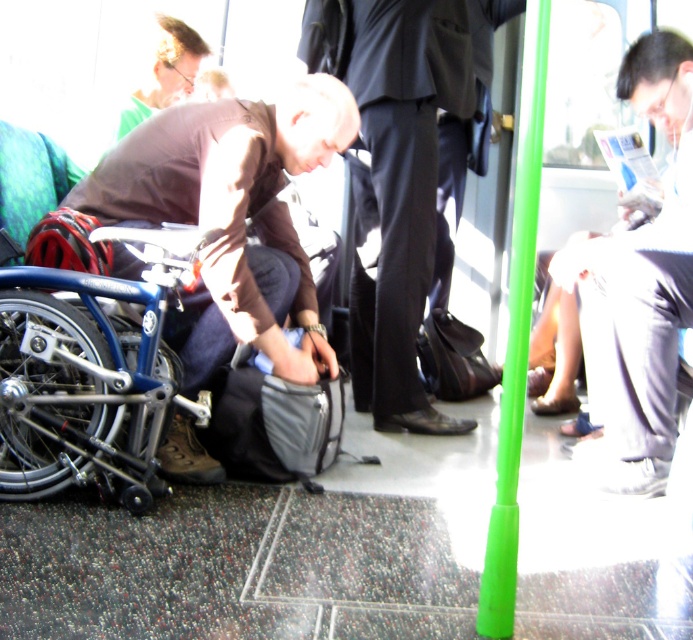
You are a passenger on a train and need to find a place to sit. You see a dark gray suit at center and a matte brown shirt at upper left. Which one is larger?

The dark gray suit at center is bigger than the matte brown shirt at upper left.

You are a passenger on a train and need to reach the green plastic pole at center to steady yourself. You are currently standing near the matte brown shirt at upper left. Which direction should you move to reach the pole?

The green plastic pole at center is positioned under the matte brown shirt at upper left, so you should move downward from the matte brown shirt at upper left to reach the pole.